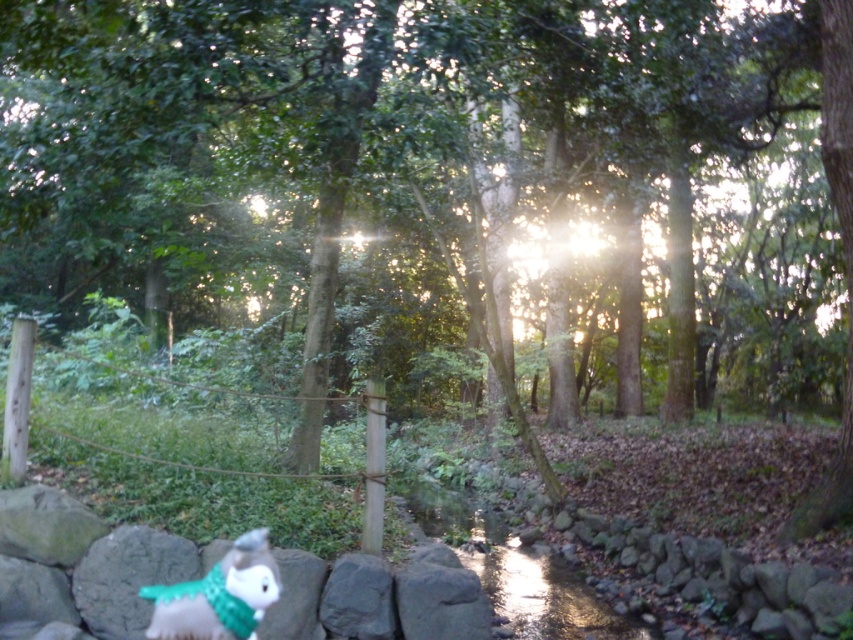
Question: Considering the real-world distances, which object is farthest from the shiny metallic creek at center?

Choices:
 (A) fluffy gray stuffed animal at lower left
 (B) ropewooden post at center

Answer: (A)

Question: Which object is closer to the camera taking this photo?

Choices:
 (A) shiny metallic creek at center
 (B) ropewooden post at center
 (C) fluffy gray stuffed animal at lower left

Answer: (C)

Question: Can you confirm if ropewooden post at center is positioned below fluffy gray stuffed animal at lower left?

Choices:
 (A) no
 (B) yes

Answer: (A)

Question: Is ropewooden post at center positioned in front of fluffy gray stuffed animal at lower left?

Choices:
 (A) yes
 (B) no

Answer: (B)

Question: Which point appears closest to the camera in this image?

Choices:
 (A) (154, 618)
 (B) (461, 516)

Answer: (A)

Question: Is ropewooden post at center positioned in front of shiny metallic creek at center?

Choices:
 (A) no
 (B) yes

Answer: (B)